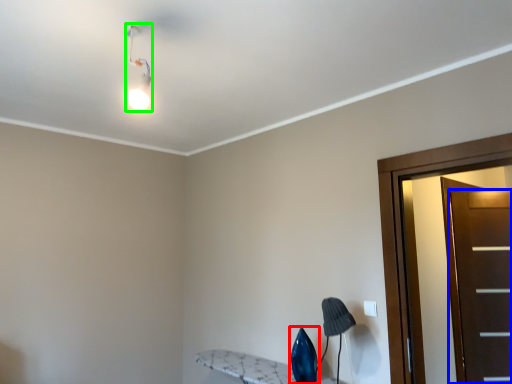
Question: Based on their relative distances, which object is farther from swivel chair (highlighted by a red box)? Choose from door (highlighted by a blue box) and light fixture (highlighted by a green box).

Choices:
 (A) door
 (B) light fixture

Answer: (B)